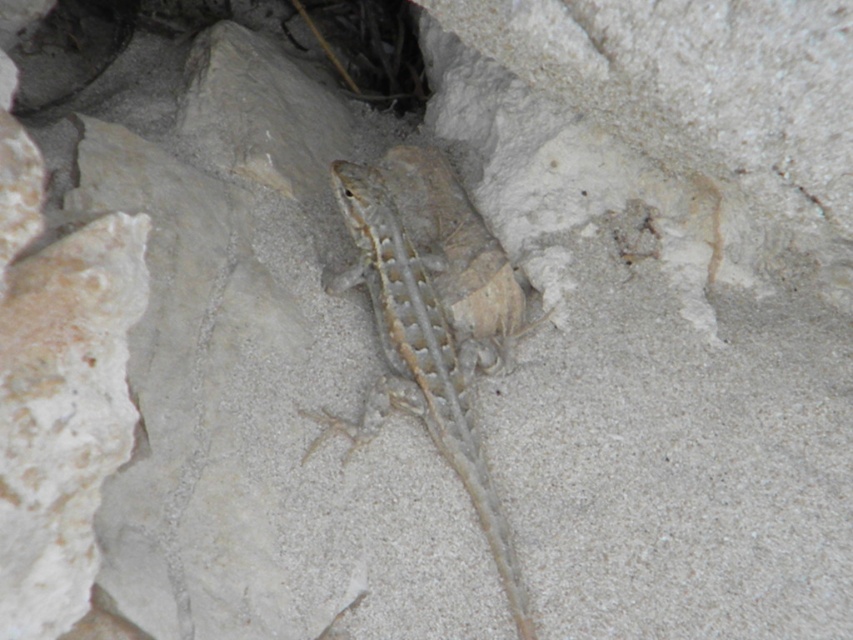
Question: Which point is farther from the camera taking this photo?

Choices:
 (A) (59, 16)
 (B) (466, 221)

Answer: (A)

Question: Does desert gray scaly lizard at center appear under smooth stone hole at upper left?

Choices:
 (A) no
 (B) yes

Answer: (B)

Question: Is the position of desert gray scaly lizard at center more distant than that of smooth stone hole at upper left?

Choices:
 (A) no
 (B) yes

Answer: (A)

Question: Does desert gray scaly lizard at center appear under smooth stone hole at upper left?

Choices:
 (A) yes
 (B) no

Answer: (A)